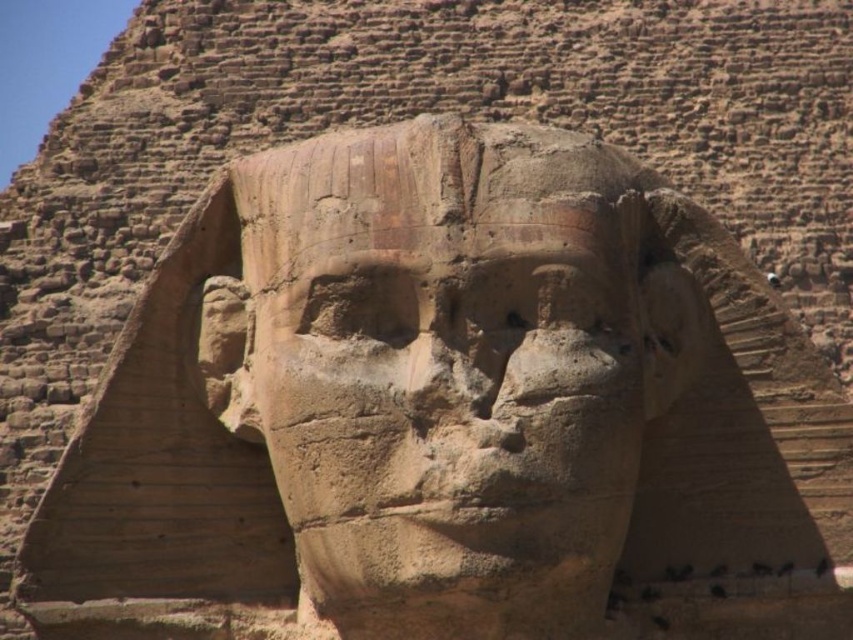
Question: Does sandstone statue at center appear on the left side of brown stone nose at center?

Choices:
 (A) yes
 (B) no

Answer: (B)

Question: Where is sandstone statue at center located in relation to brown stone nose at center in the image?

Choices:
 (A) right
 (B) left

Answer: (A)

Question: Does sandstone statue at center have a smaller size compared to brown stone nose at center?

Choices:
 (A) yes
 (B) no

Answer: (B)

Question: Which point is closer to the camera taking this photo?

Choices:
 (A) (575, 237)
 (B) (438, 387)

Answer: (B)

Question: Among these objects, which one is nearest to the camera?

Choices:
 (A) brown stone nose at center
 (B) sandstone statue at center

Answer: (B)

Question: Among these objects, which one is farthest from the camera?

Choices:
 (A) sandstone statue at center
 (B) brown stone nose at center

Answer: (B)